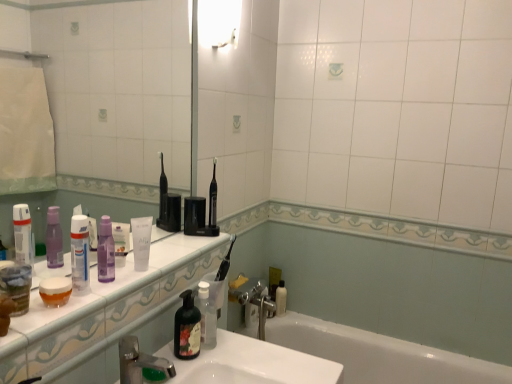
Where is `free area in between black plastic toothbrush at center and white matte tube at center, placed as the second toiletry when sorted from front to back`? The image size is (512, 384). free area in between black plastic toothbrush at center and white matte tube at center, placed as the second toiletry when sorted from front to back is located at coordinates (175, 253).